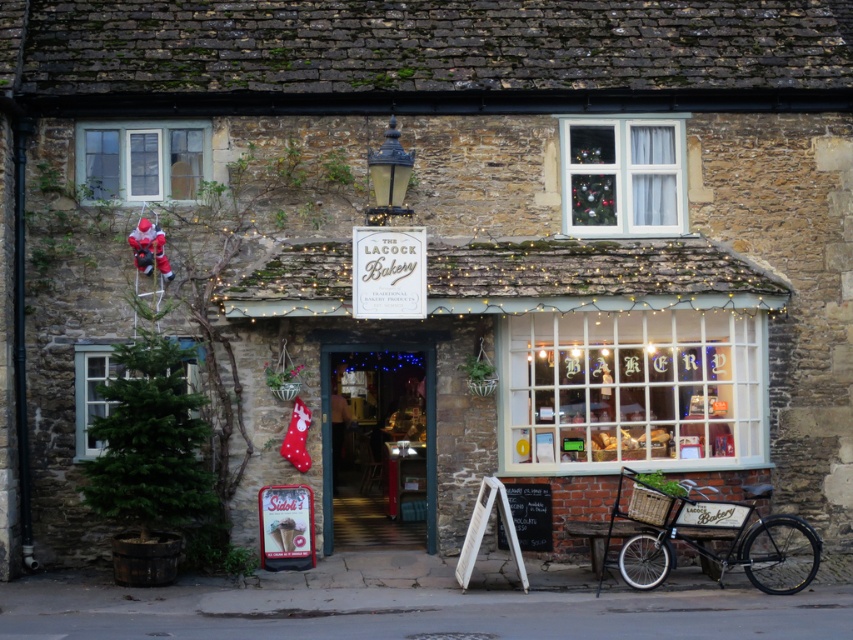
From the picture: You are a photographer planning to capture the entire matte white bakery at center and the black metal bicycle at lower right in a single frame. Given that your camera has a fixed focal length, which object should you position closer to the center of the frame to ensure both are fully visible?

You should position the matte white bakery at center closer to the center of the frame because its width is larger than the black metal bicycle at lower right, allowing it to fit better within the frame when centered.

You are a delivery person with a package that needs to be placed exactly halfway between the white plastic window at upper center and the green matte christmas tree at lower left. Where should you place the package?

The package should be placed exactly halfway between the white plastic window at upper center and the green matte christmas tree at lower left, which are 4.80 meters apart. This means the package should be placed 2.40 meters away from both objects along the line connecting them.